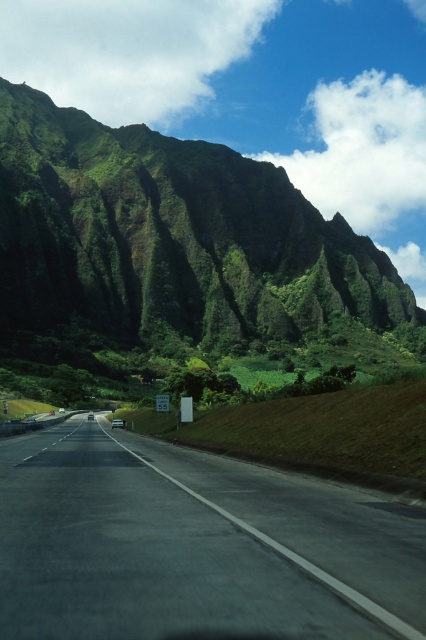
You are driving a car that is 4.5 meters long and want to park it near the green grassy mountain at upper left. The parking spot you found is 5 meters long. Is your car going to fit in the parking spot?

The parking spot is 5 meters long, and the car is 4.5 meters long. Therefore, the car will fit in the parking spot with some space to spare.

You are a driver approaching the black asphalt highway at center. You notice the green grassy mountain at upper left in your rearview mirror. Which object will appear smaller as you continue driving forward?

The green grassy mountain at upper left will appear smaller as you continue driving forward because it is bigger in reality than the black asphalt highway at center, so as you move away from it, its apparent size decreases more rapidly compared to the highway.

You are driving on the black asphalt highway at center and need to navigate around an obstacle. Which direction should you steer to avoid the green grassy mountain at upper left?

The green grassy mountain at upper left is to the right of the black asphalt highway at center, so you should steer to the left to avoid it.